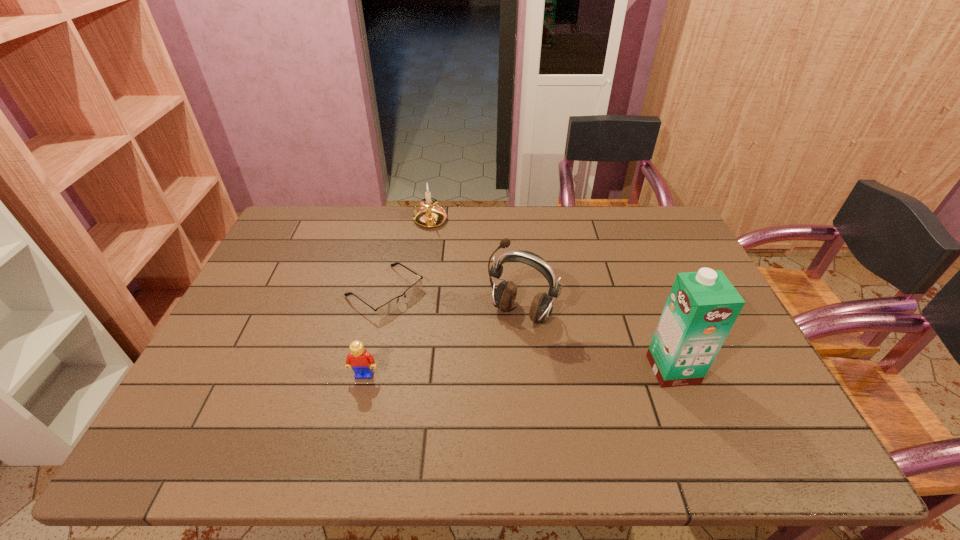
The image size is (960, 540). Identify the location of vacant space located on the front-facing side of the shortest object. (474, 354).

Where is `vacant region located 0.230m on the front-facing side of the shortest object`? The image size is (960, 540). vacant region located 0.230m on the front-facing side of the shortest object is located at coordinates (471, 353).

You are a GUI agent. You are given a task and a screenshot of the screen. Output one action in this format:
    pyautogui.click(x=<x>, y=<y>)
    Task: Click on the vacant region located on the ear pads of the earphone
    Image resolution: width=960 pixels, height=540 pixels.
    Given the screenshot: What is the action you would take?
    pyautogui.click(x=499, y=343)

What are the coordinates of `free region located on the ear pads of the earphone` in the screenshot? It's located at (473, 386).

At what (x,y) coordinates should I click in order to perform the action: click on vacant area situated on the ear pads of the earphone. Please return your answer as a coordinate pair (x, y). Looking at the image, I should click on (493, 354).

Find the location of a particular element. Image resolution: width=960 pixels, height=540 pixels. free space located 0.210m on the handle side of the farthest object is located at coordinates (450, 271).

You are a GUI agent. You are given a task and a screenshot of the screen. Output one action in this format:
    pyautogui.click(x=<x>, y=<y>)
    Task: Click on the vacant space located on the handle side of the farthest object
    The height and width of the screenshot is (540, 960).
    Given the screenshot: What is the action you would take?
    pyautogui.click(x=448, y=267)

This screenshot has height=540, width=960. I want to click on free space located 0.080m on the handle side of the farthest object, so click(440, 246).

This screenshot has height=540, width=960. Identify the location of object at the far edge. (429, 215).

The height and width of the screenshot is (540, 960). Identify the location of object present at the near edge. (702, 307).